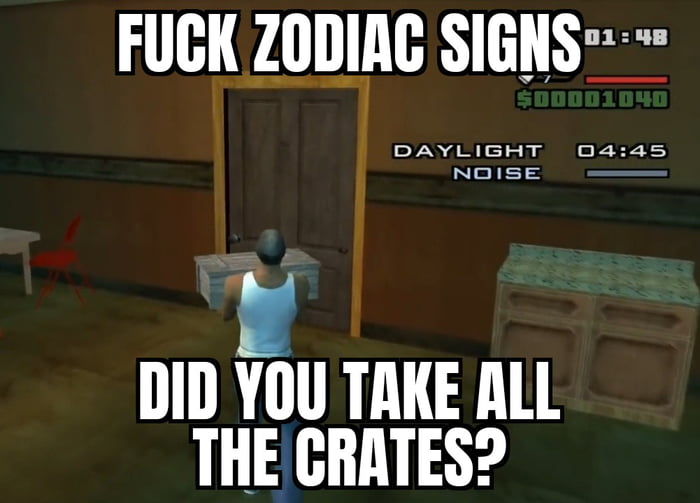
You are a GUI agent. You are given a task and a screenshot of the screen. Output one action in this format:
    pyautogui.click(x=<x>, y=<y>)
    Task: Click on the door
    This screenshot has width=700, height=503.
    Given the screenshot: What is the action you would take?
    pyautogui.click(x=294, y=171)